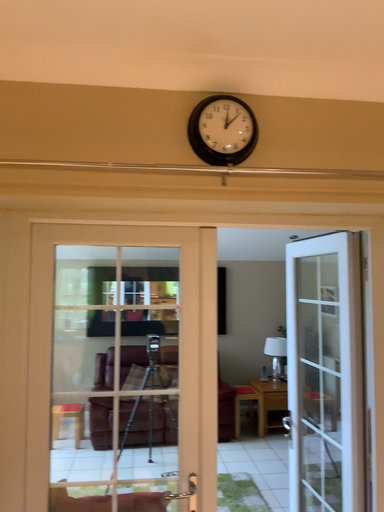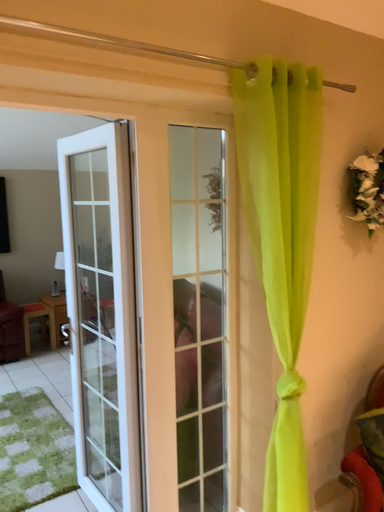
Question: Which way did the camera rotate in the video?

Choices:
 (A) rotated downward
 (B) rotated upward

Answer: (A)